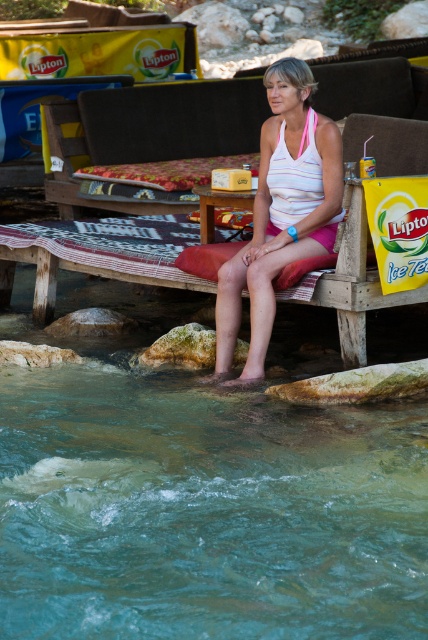
Can you confirm if white striped tank top at center is positioned above wooden picnic table at center?

No, white striped tank top at center is not above wooden picnic table at center.

Is point (329, 161) in front of point (211, 211)?

Yes, point (329, 161) is in front of point (211, 211).

At what (x,y) coordinates should I click in order to perform the action: click on white striped tank top at center. Please return your answer as a coordinate pair (x, y). The height and width of the screenshot is (640, 428). Looking at the image, I should click on (281, 211).

Is wooden park bench at center further to the viewer compared to wooden picnic table at center?

Yes.

The image size is (428, 640). Find the location of `wooden park bench at center`. wooden park bench at center is located at coordinates (168, 120).

In the scene shown: Is clear water at feet lower below white striped tank top at center?

Indeed, clear water at feet lower is positioned under white striped tank top at center.

Is point (163, 579) closer to camera compared to point (272, 272)?

Yes, it is in front of point (272, 272).

Is point (11, 545) farther from viewer compared to point (231, 381)?

No, (11, 545) is in front of (231, 381).

You are a GUI agent. You are given a task and a screenshot of the screen. Output one action in this format:
    pyautogui.click(x=<x>, y=<y>)
    Task: Click on the clear water at feet lower
    
    Given the screenshot: What is the action you would take?
    pyautogui.click(x=205, y=512)